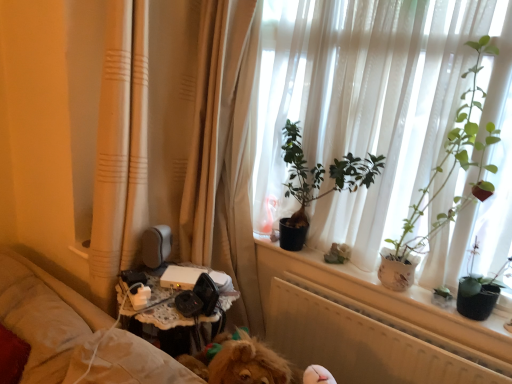
Question: Is beige fabric curtain at left at the left side of green matte plant at center, the 2th houseplant positioned from the right?

Choices:
 (A) yes
 (B) no

Answer: (A)

Question: Is beige fabric curtain at left at the right side of green matte plant at center, acting as the first houseplant starting from the left?

Choices:
 (A) no
 (B) yes

Answer: (A)

Question: Considering the relative sizes of beige fabric curtain at left and green matte plant at center, the 2th houseplant positioned from the right, in the image provided, is beige fabric curtain at left smaller than green matte plant at center, the 2th houseplant positioned from the right,?

Choices:
 (A) yes
 (B) no

Answer: (B)

Question: Is beige fabric curtain at left positioned before green matte plant at center, the 2th houseplant positioned from the right?

Choices:
 (A) no
 (B) yes

Answer: (B)

Question: Is beige fabric curtain at left facing away from green matte plant at center, the 2th houseplant positioned from the right?

Choices:
 (A) no
 (B) yes

Answer: (A)

Question: Is beige fabric curtain at left further to the viewer compared to green matte plant at center, acting as the first houseplant starting from the left?

Choices:
 (A) no
 (B) yes

Answer: (A)

Question: Would you say green matte plant at upper right, which is counted as the 1th houseplant, starting from the right, is part of green matte plant at center, acting as the first houseplant starting from the left,'s contents?

Choices:
 (A) yes
 (B) no

Answer: (B)

Question: Is the depth of green matte plant at center, the 2th houseplant positioned from the right, less than that of green matte plant at upper right, which is counted as the 1th houseplant, starting from the right?

Choices:
 (A) no
 (B) yes

Answer: (A)

Question: From the image's perspective, is green matte plant at center, the 2th houseplant positioned from the right, below green matte plant at upper right, which is counted as the 1th houseplant, starting from the right?

Choices:
 (A) yes
 (B) no

Answer: (A)

Question: Is green matte plant at center, acting as the first houseplant starting from the left, far from green matte plant at upper right, placed as the 2th houseplant when sorted from left to right?

Choices:
 (A) no
 (B) yes

Answer: (A)

Question: From a real-world perspective, is green matte plant at center, acting as the first houseplant starting from the left, below green matte plant at upper right, which is counted as the 1th houseplant, starting from the right?

Choices:
 (A) yes
 (B) no

Answer: (A)

Question: Are green matte plant at center, acting as the first houseplant starting from the left, and green matte plant at upper right, placed as the 2th houseplant when sorted from left to right, making contact?

Choices:
 (A) no
 (B) yes

Answer: (A)

Question: Does green matte plant at upper right, which is counted as the 1th houseplant, starting from the right, lie in front of beige fabric curtain at left?

Choices:
 (A) no
 (B) yes

Answer: (A)